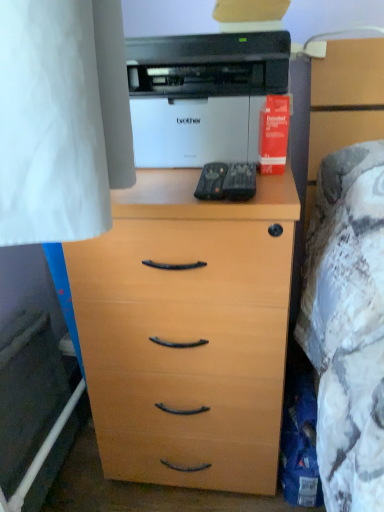
Question: Does point (271, 109) appear closer or farther from the camera than point (157, 308)?

Choices:
 (A) closer
 (B) farther

Answer: (A)

Question: Would you say red matte paper at upper right is inside or outside light wood chest of drawers at center?

Choices:
 (A) outside
 (B) inside

Answer: (A)

Question: Which of these objects is positioned closest to the red matte paper at upper right?

Choices:
 (A) white glossy printer at upper center
 (B) light wood chest of drawers at center

Answer: (A)

Question: Which object is the farthest from the red matte paper at upper right?

Choices:
 (A) light wood chest of drawers at center
 (B) white glossy printer at upper center

Answer: (A)